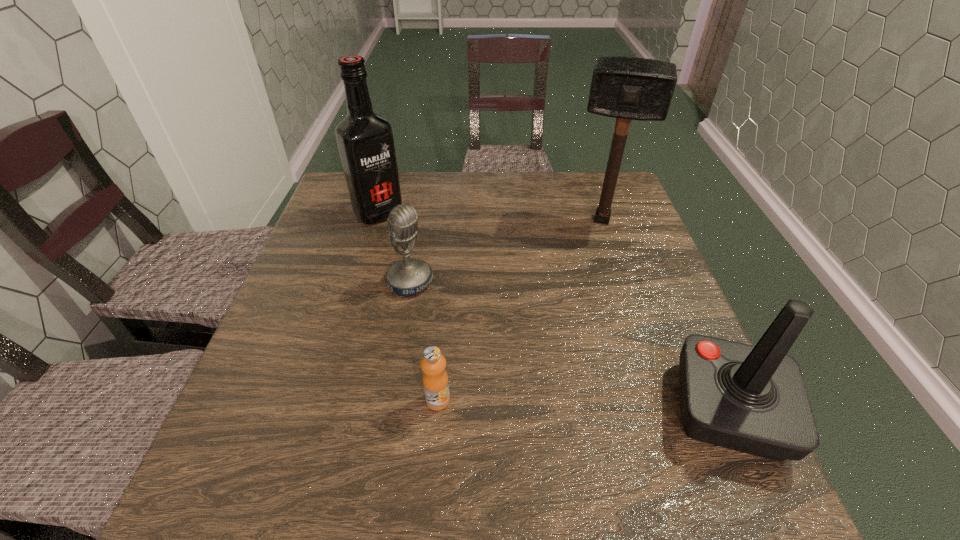
Find the location of a particular element. free space on the desktop that is between the third object from right to left and the third shortest object and is positioned on the front-facing side of the microphone is located at coordinates (587, 405).

Image resolution: width=960 pixels, height=540 pixels. Find the location of `free spot on the desktop that is between the third object from right to left and the joystick and is positioned on the head of the mallet`. free spot on the desktop that is between the third object from right to left and the joystick and is positioned on the head of the mallet is located at coordinates (574, 404).

Where is `vacant space on the desktop that is between the shortest object and the third shortest object and is positioned on the front-facing side of the liquor`? vacant space on the desktop that is between the shortest object and the third shortest object and is positioned on the front-facing side of the liquor is located at coordinates (580, 405).